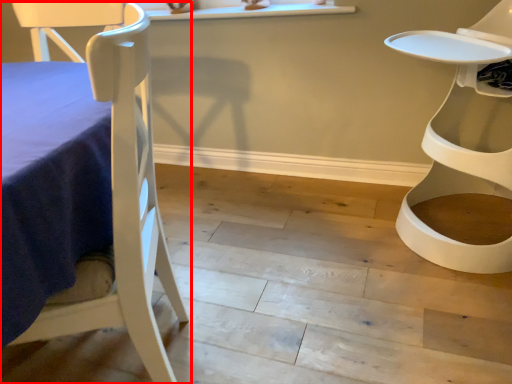
Question: Observing the image, what is the correct spatial positioning of chair (annotated by the red box) in reference to chair?

Choices:
 (A) right
 (B) left

Answer: (B)